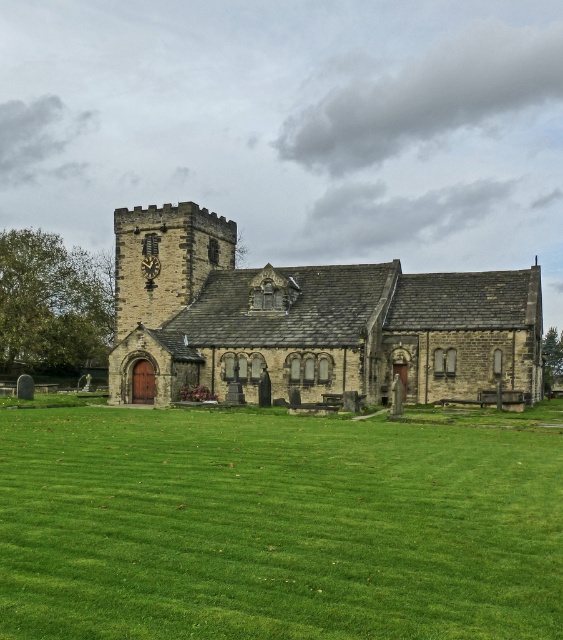
Can you confirm if green grass at center is positioned to the right of stone church at center?

No, green grass at center is not to the right of stone church at center.

Where is `green grass at center`? Image resolution: width=563 pixels, height=640 pixels. green grass at center is located at coordinates (275, 525).

You are a GUI agent. You are given a task and a screenshot of the screen. Output one action in this format:
    pyautogui.click(x=<x>, y=<y>)
    Task: Click on the green grass at center
    Image resolution: width=563 pixels, height=640 pixels.
    Given the screenshot: What is the action you would take?
    pyautogui.click(x=275, y=525)